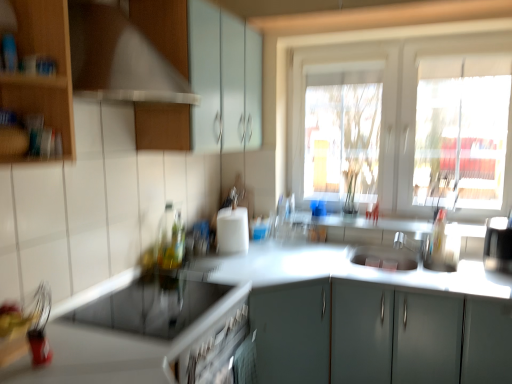
Find the location of a particular element. The height and width of the screenshot is (384, 512). free space above white glossy window at upper center (from a real-world perspective) is located at coordinates (402, 33).